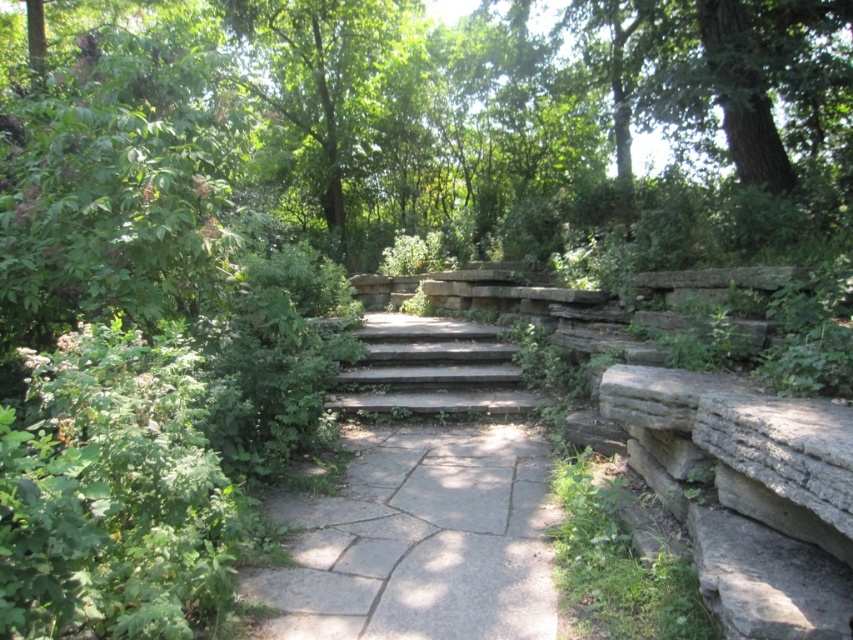
Is gray stone path at center closer to camera compared to green leafy tree at upper center?

Yes, it is.

I want to click on gray stone path at center, so click(419, 541).

Between gray stone path at center and gray stone stairs at center, which one appears on the right side from the viewer's perspective?

From the viewer's perspective, gray stone path at center appears more on the right side.

Does point (524, 636) lie in front of point (370, 316)?

That is True.

Identify the location of gray stone path at center. This screenshot has width=853, height=640. tap(419, 541).

At what (x,y) coordinates should I click in order to perform the action: click on gray stone path at center. Please return your answer as a coordinate pair (x, y). The image size is (853, 640). Looking at the image, I should click on (419, 541).

Who is positioned more to the left, green leafy tree at upper center or gray stone stairs at center?

green leafy tree at upper center

Between green leafy tree at upper center and gray stone stairs at center, which one has more height?

With more height is green leafy tree at upper center.

Locate an element on the screen. This screenshot has width=853, height=640. green leafy tree at upper center is located at coordinates (334, 90).

At what (x,y) coordinates should I click in order to perform the action: click on green leafy tree at upper center. Please return your answer as a coordinate pair (x, y). Looking at the image, I should click on (334, 90).